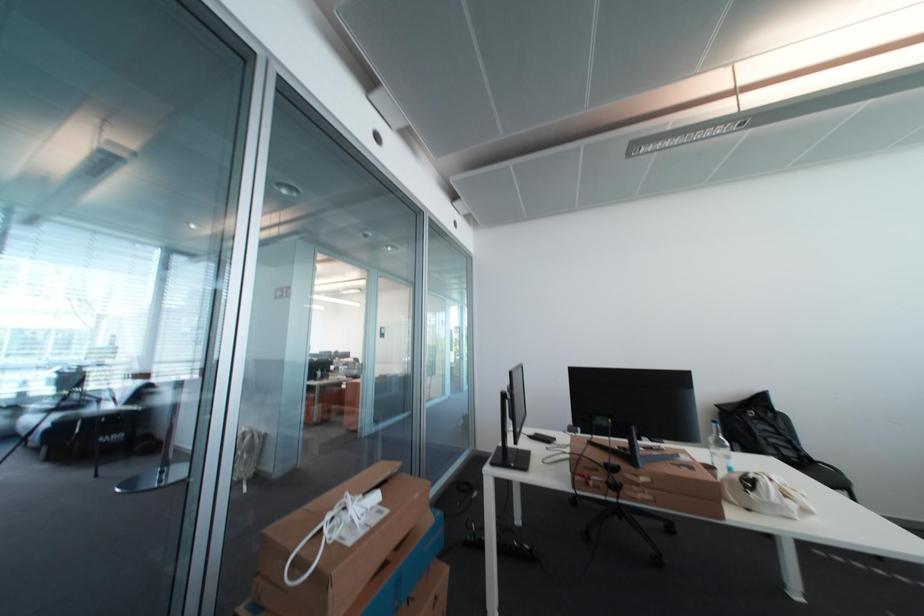
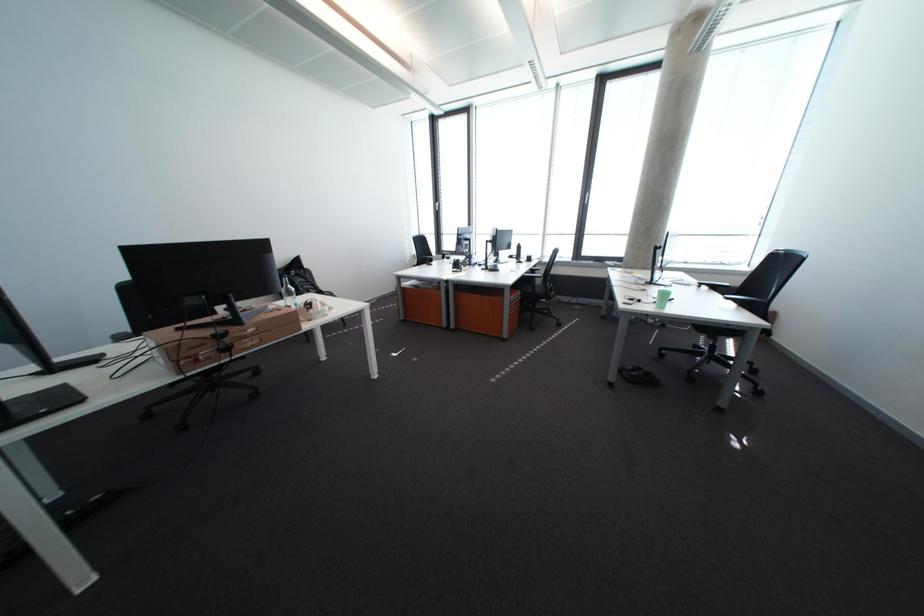
The first image is from the beginning of the video and the second image is from the end. How did the camera likely rotate when shooting the video?

The rotation direction of the camera is right-down.